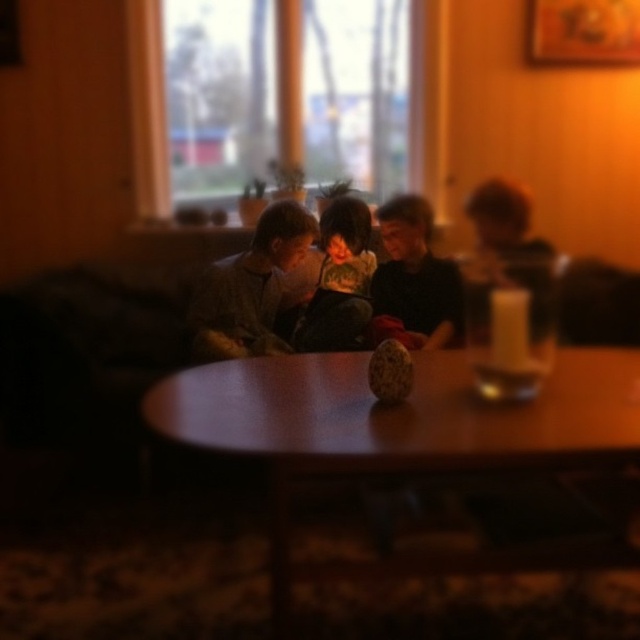
You are a person who is 1.7 meters tall. You are standing in the room and see the wooden table at center and the smooth black shirt at center. Which object is taller than you?

The wooden table at center is much taller than the smooth black shirt at center, but since the smooth black shirt at center is likely part of a person, neither of them are taller than you as a 1.7 meters tall person.

You are standing in the room and want to place a small book on the wooden table at center. However, you notice the smooth black shirt at center is in the way. Can you place the book on the table without moving the shirt?

The wooden table at center is closer to the viewer than the smooth black shirt at center, so you can place the book on the wooden table at center without moving the smooth black shirt at center because the table is in front of the shirt.

You are organizing a small gathering and need to place a large platter of food on the wooden table at center. The dark green textured sweater at center is currently occupying space on the table. Can you fit the platter without moving the sweater?

The wooden table at center is bigger than the dark green textured sweater at center, so there should be enough space to place the platter without moving the sweater.